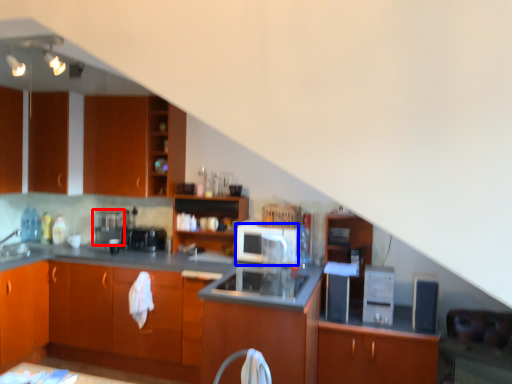
Question: Which of the following is the farthest to the observer, coffee machine (highlighted by a red box) or appliance (highlighted by a blue box)?

Choices:
 (A) coffee machine
 (B) appliance

Answer: (A)